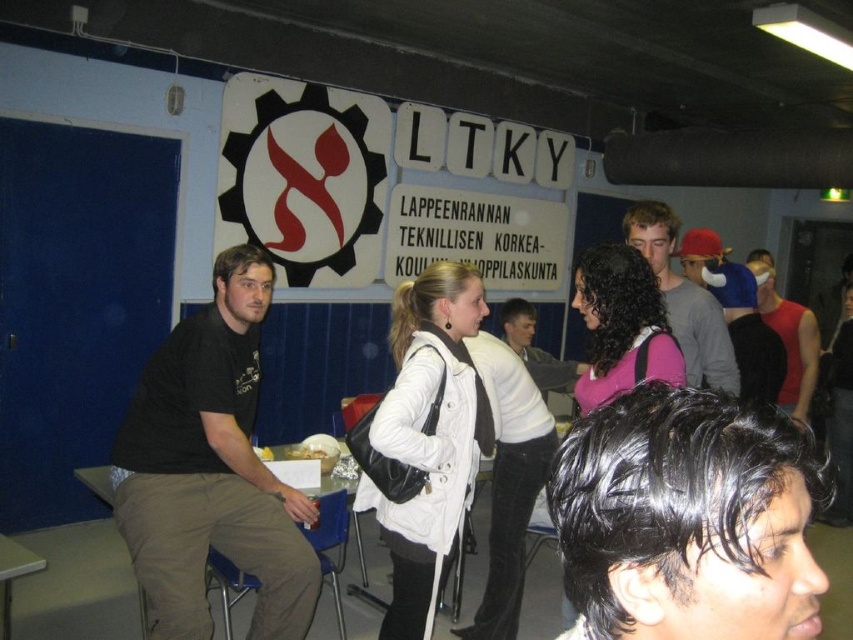
Which of these two, red sleeveless shirt at right or yellow matte food at center, stands taller?

red sleeveless shirt at right is taller.

Looking at this image, can you confirm if red sleeveless shirt at right is wider than yellow matte food at center?

Yes.

Does point (810, 323) come behind point (300, 449)?

Yes.

The image size is (853, 640). What are the coordinates of `red sleeveless shirt at right` in the screenshot? It's located at (790, 340).

Who is taller, light brown leather jacket at center or blue denim jacket at center?

blue denim jacket at center is taller.

What do you see at coordinates (683, 298) in the screenshot? I see `light brown leather jacket at center` at bounding box center [683, 298].

Is point (656, 211) less distant than point (749, 276)?

Yes, point (656, 211) is closer to viewer.

In order to click on light brown leather jacket at center in this screenshot , I will do `click(683, 298)`.

Does point (660, 244) come behind point (758, 282)?

That is False.

Who is positioned more to the right, light brown leather jacket at center or red sleeveless shirt at right?

Positioned to the right is red sleeveless shirt at right.

Does point (640, 211) come in front of point (793, 353)?

Yes, it is.

Where is `light brown leather jacket at center`? This screenshot has height=640, width=853. light brown leather jacket at center is located at coordinates (683, 298).